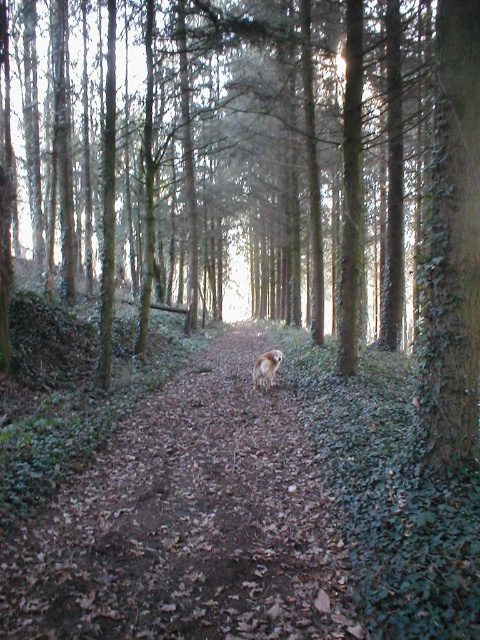
Does brown leafy forest path at center come in front of furry golden dog at center?

Yes.

Does point (206, 484) lie in front of point (271, 356)?

Yes, point (206, 484) is in front of point (271, 356).

Which is behind, point (297, 554) or point (279, 355)?

Point (279, 355)

What are the coordinates of `brown leafy forest path at center` in the screenshot? It's located at (188, 524).